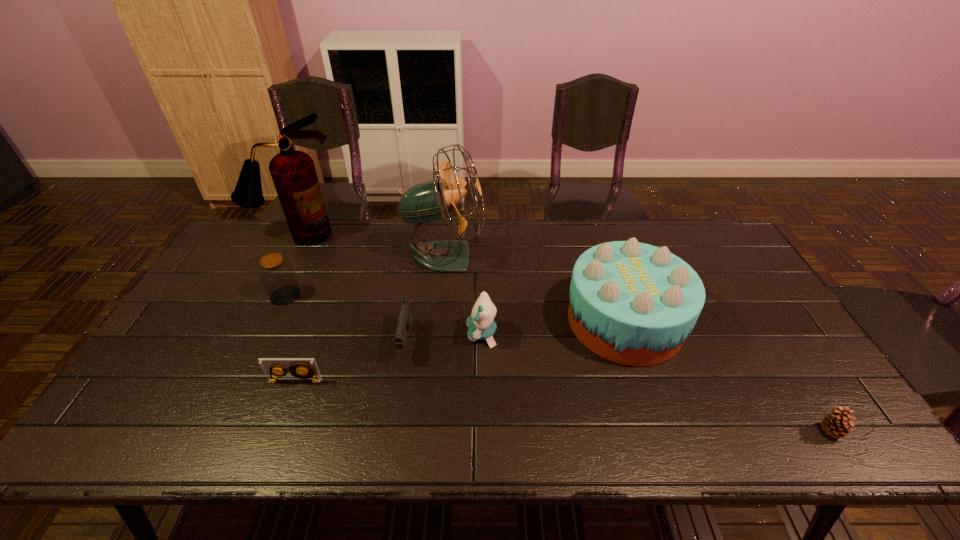
In the image, there is a desktop. Where is `vacant space at the right edge`? vacant space at the right edge is located at coordinates (723, 302).

The image size is (960, 540). In the image, there is a desktop. What are the coordinates of `blank space at the near left corner` in the screenshot? It's located at [97, 442].

The height and width of the screenshot is (540, 960). In the image, there is a desktop. Find the location of `blank space at the far right corner`. blank space at the far right corner is located at coordinates (702, 240).

You are a GUI agent. You are given a task and a screenshot of the screen. Output one action in this format:
    pyautogui.click(x=<x>, y=<y>)
    Task: Click on the free location at the near right corner of the desktop
    
    Given the screenshot: What is the action you would take?
    pyautogui.click(x=841, y=438)

Locate an element on the screen. free point between the cake and the fire extinguisher is located at coordinates (462, 278).

This screenshot has height=540, width=960. In order to click on free space that is in between the pistol and the pinecone in this screenshot , I will do `click(619, 386)`.

You are a GUI agent. You are given a task and a screenshot of the screen. Output one action in this format:
    pyautogui.click(x=<x>, y=<y>)
    Task: Click on the free space between the nearest object and the fire extinguisher
    Image resolution: width=960 pixels, height=540 pixels.
    Given the screenshot: What is the action you would take?
    pyautogui.click(x=565, y=333)

What are the coordinates of `free space between the nearest object and the jar` in the screenshot? It's located at (559, 363).

Where is `free space between the jar and the nearest object`? This screenshot has height=540, width=960. free space between the jar and the nearest object is located at coordinates (559, 363).

This screenshot has height=540, width=960. In order to click on free spot between the pistol and the jar in this screenshot , I will do `click(346, 319)`.